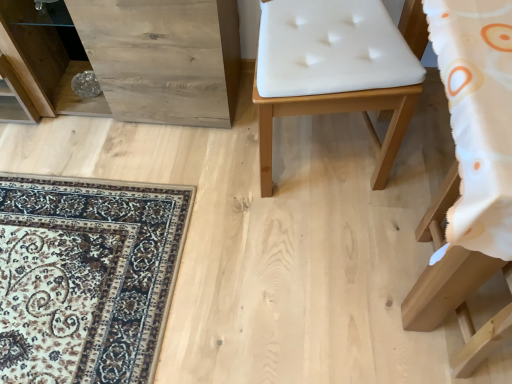
Question: Considering their positions, is natural wood dresser at left located in front of or behind white leather chair at center, which is the 2th furniture from bottom to top?

Choices:
 (A) front
 (B) behind

Answer: (B)

Question: Considering the positions of point (187, 31) and point (415, 52), is point (187, 31) closer or farther from the camera than point (415, 52)?

Choices:
 (A) closer
 (B) farther

Answer: (A)

Question: Which object is the farthest from the natural wood dresser at left?

Choices:
 (A) white fabric cushion at lower right, which is the first furniture in right-to-left order
 (B) white leather chair at center, which is counted as the first furniture, starting from the top

Answer: (A)

Question: Considering the real-world distances, which object is farthest from the natural wood dresser at left?

Choices:
 (A) white leather chair at center, which is counted as the first furniture, starting from the top
 (B) white fabric cushion at lower right, acting as the second furniture starting from the top

Answer: (B)